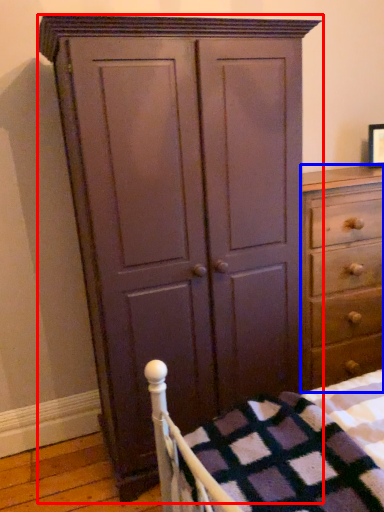
Question: Which object appears farthest to the camera in this image, cupboard (highlighted by a red box) or chest of drawers (highlighted by a blue box)?

Choices:
 (A) cupboard
 (B) chest of drawers

Answer: (B)